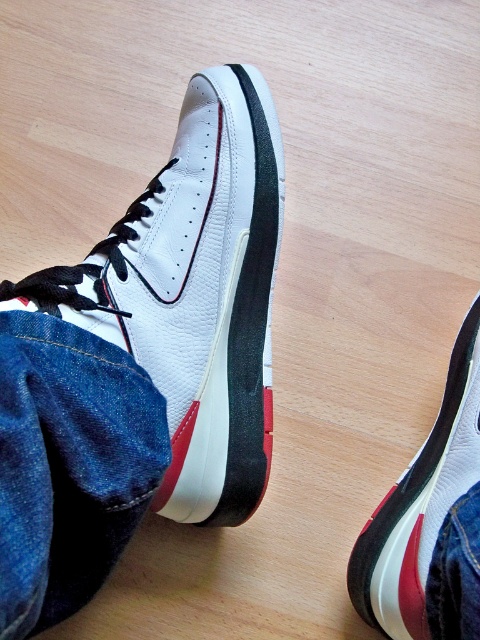
You are trying to determine if the denim at lower left and denim at lower right can both fit into a narrow drawer. Based on their widths, which one is wider?

The denim at lower left is wider than denim at lower right, so it would not fit into the narrow drawer as easily as the denim at lower right.

You are a photographer setting up a shoot for a sneaker advertisement. You have a white leather sneaker at center and a denim at lower left in your frame. Which object should you focus on if you want to highlight the larger item in the scene?

The white leather sneaker at center is bigger than the denim at lower left, so you should focus on the white leather sneaker at center to highlight the larger item.